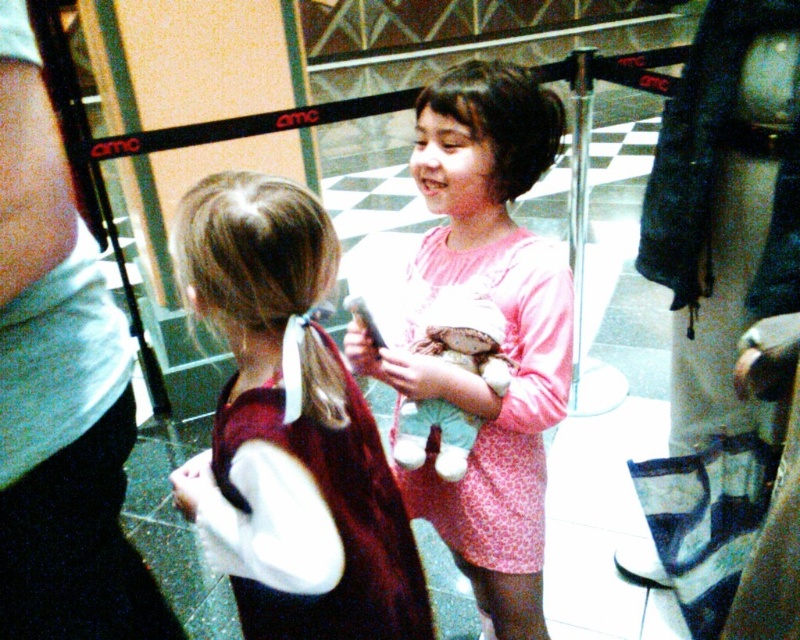
Is white cotton shirt at upper left behind pink fabric dress at center?

That is False.

Does white cotton shirt at upper left have a greater width compared to pink fabric dress at center?

No.

Who is more distant from viewer, (10, 372) or (506, 125)?

The point (506, 125) is behind.

The width and height of the screenshot is (800, 640). I want to click on white cotton shirt at upper left, so click(60, 390).

Is pink fabric dress at center to the left of fluffy plush toy at center from the viewer's perspective?

No, pink fabric dress at center is not to the left of fluffy plush toy at center.

Between pink fabric dress at center and fluffy plush toy at center, which one has more height?

Standing taller between the two is pink fabric dress at center.

This screenshot has width=800, height=640. Find the location of `pink fabric dress at center`. pink fabric dress at center is located at coordinates (506, 332).

Based on the photo, between white cotton shirt at upper left and maroon velvet dress at center, which one is positioned higher?

white cotton shirt at upper left

Between white cotton shirt at upper left and maroon velvet dress at center, which one appears on the right side from the viewer's perspective?

From the viewer's perspective, maroon velvet dress at center appears more on the right side.

Does point (44, 410) come closer to viewer compared to point (314, 433)?

Yes, it is.

Find the location of `white cotton shirt at upper left`. white cotton shirt at upper left is located at coordinates (60, 390).